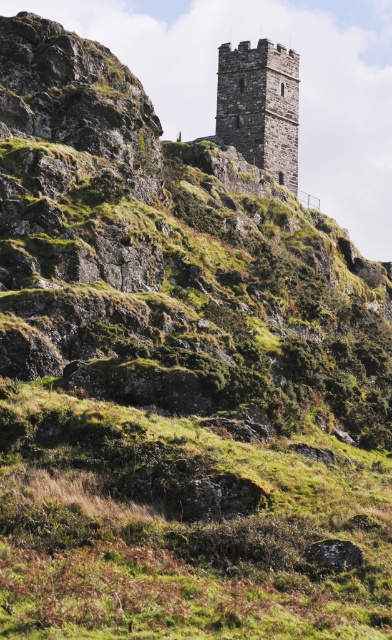
Question: Can you confirm if green grassy at center is smaller than stone tower at upper center?

Choices:
 (A) no
 (B) yes

Answer: (A)

Question: From the image, what is the correct spatial relationship of green grassy at center in relation to stone tower at upper center?

Choices:
 (A) above
 (B) below

Answer: (B)

Question: Which of the following is the farthest from the observer?

Choices:
 (A) (255, 120)
 (B) (196, 426)

Answer: (A)

Question: Does green grassy at center have a lesser width compared to stone tower at upper center?

Choices:
 (A) no
 (B) yes

Answer: (A)